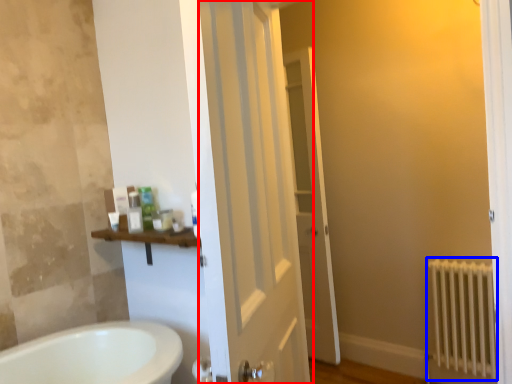
Question: Which object is closer to the camera taking this photo, door (highlighted by a red box) or radiator (highlighted by a blue box)?

Choices:
 (A) door
 (B) radiator

Answer: (A)